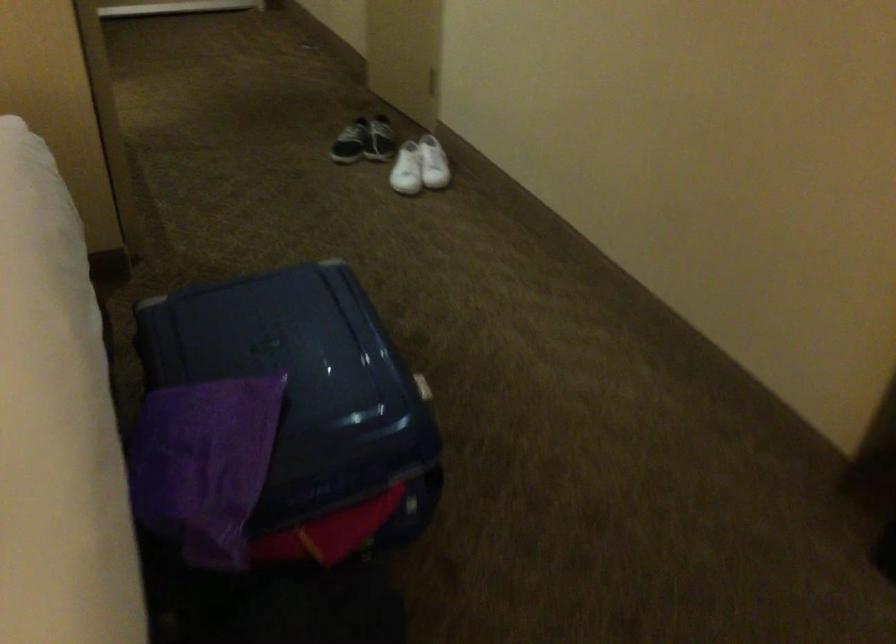
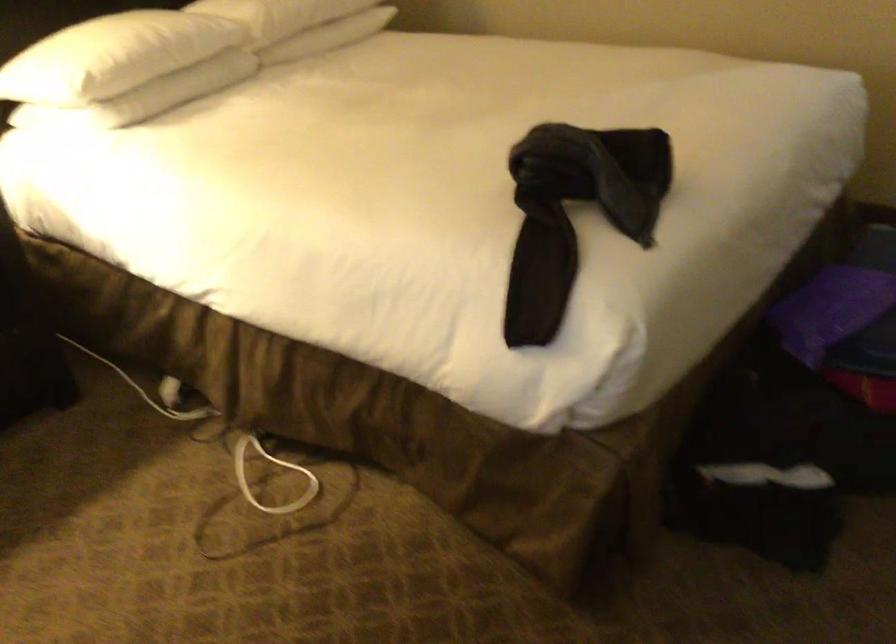
In the second image, find the point that corresponds to pixel 228 466 in the first image.

(831, 310)